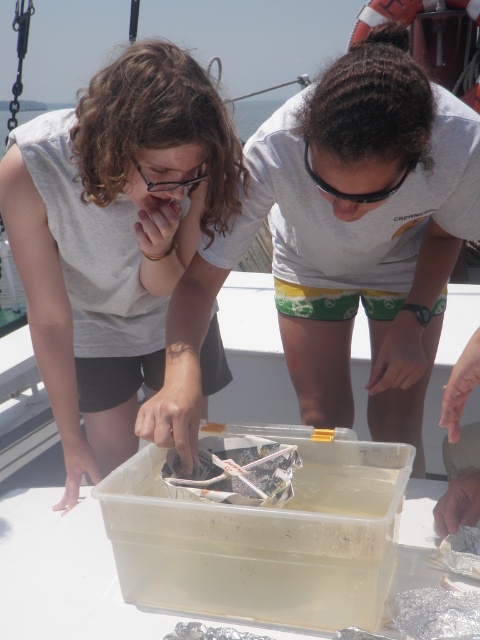
Question: Is matte white shirt at center behind clear plastic goggles at center?

Choices:
 (A) no
 (B) yes

Answer: (A)

Question: Which object is the farthest from the white matte plastic container at center?

Choices:
 (A) clear plastic bag at center
 (B) matte white shirt at center
 (C) black plastic goggles at center

Answer: (A)

Question: Is transparent plastic container at center below black plastic goggles at center?

Choices:
 (A) yes
 (B) no

Answer: (A)

Question: Which point is farther from the camera taking this photo?

Choices:
 (A) (x=272, y=212)
 (B) (x=379, y=198)
 (C) (x=169, y=468)
 (D) (x=308, y=605)

Answer: (A)

Question: Is transparent plastic container at center below black plastic goggles at center?

Choices:
 (A) yes
 (B) no

Answer: (A)

Question: Estimate the real-world distances between objects in this image. Which object is farther from the white matte plastic container at center?

Choices:
 (A) matte white shirt at center
 (B) clear plastic goggles at center
 (C) transparent plastic container at center
 (D) black plastic goggles at center

Answer: (B)